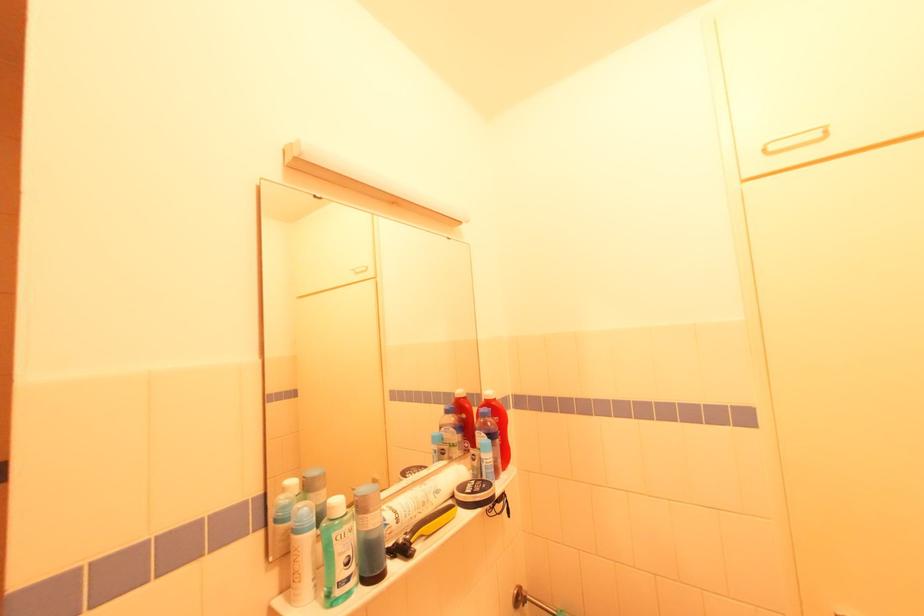
Find the location of a particular element. Image resolution: width=924 pixels, height=616 pixels. blue liquid bottle is located at coordinates (370, 535).